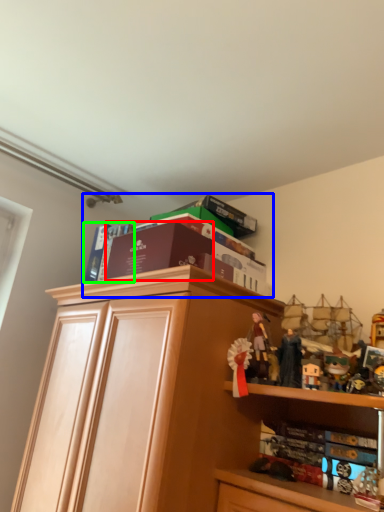
Question: Estimate the real-world distances between objects in this image. Which object is farther from book (highlighted by a red box), book (highlighted by a blue box) or book (highlighted by a green box)?

Choices:
 (A) book
 (B) book

Answer: (B)